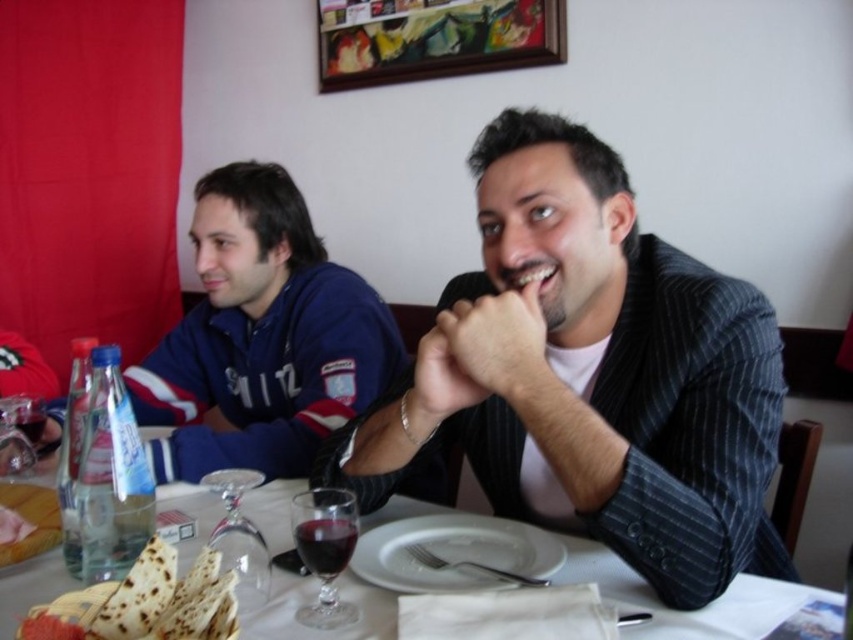
Question: Can you confirm if white glossy plate at center is positioned above wooden picture frame at upper center?

Choices:
 (A) yes
 (B) no

Answer: (B)

Question: Does wooden picture frame at upper center appear over transparent glass wine glass at left?

Choices:
 (A) no
 (B) yes

Answer: (B)

Question: Which point is closer to the camera?

Choices:
 (A) (341, 570)
 (B) (631, 308)

Answer: (A)

Question: Which point is farther from the camera taking this photo?

Choices:
 (A) (254, 600)
 (B) (144, 557)
 (C) (329, 609)

Answer: (A)

Question: Which object is the closest to the striped suit jacket at center?

Choices:
 (A) transparent glass wine glass at left
 (B) blue fleece jacket at left
 (C) white glossy plate at center

Answer: (C)

Question: In this image, where is striped suit jacket at center located relative to transparent glass wine glass at lower left?

Choices:
 (A) right
 (B) left

Answer: (A)